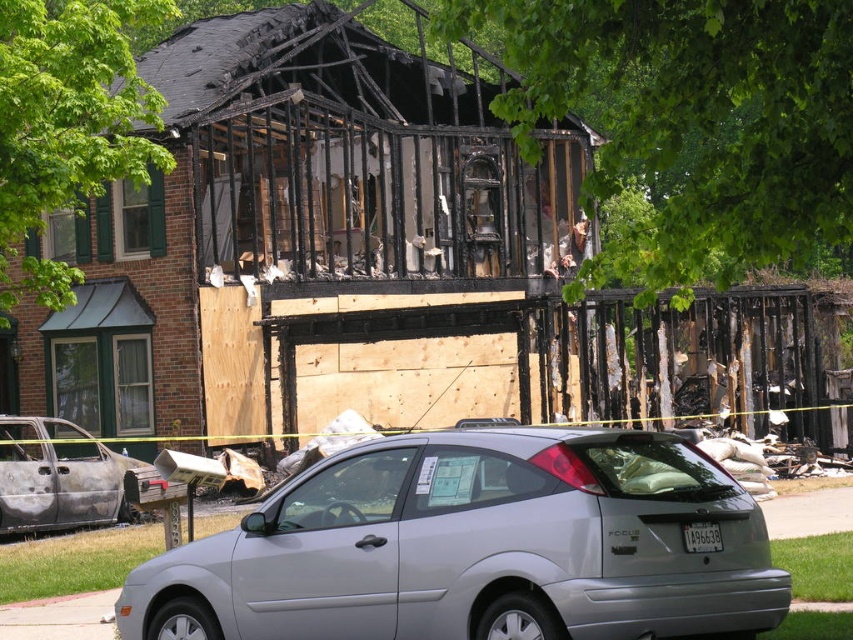
You are a delivery driver who needs to park your truck between the silver metallic hatchback at center and the burnt metallic car at lower left. Can you park your truck in this space?

The silver metallic hatchback at center is closer to the viewer than the burnt metallic car at lower left, so the distance between them is sufficient for parking your truck.

You are a delivery driver who needs to park your van in this residential area. You see a silver metallic hatchback at center and a burnt metallic car at lower left. Which vehicle is blocking the parking spot more?

The silver metallic hatchback at center is positioned over burnt metallic car at lower left, meaning it is closer to the parking spot and thus blocking it more.

You are a delivery driver who needs to park your truck next to the silver metallic hatchback at center and the burnt metallic car at lower left. Your truck is 6 meters long. Can you park your truck between them without overlapping either vehicle?

The silver metallic hatchback at center is larger in size than burnt metallic car at lower left. However, the exact distance between them isn t specified in the provided information. Without knowing the space between the two vehicles, it s impossible to determine if the truck can fit. Please check the actual distance on site.